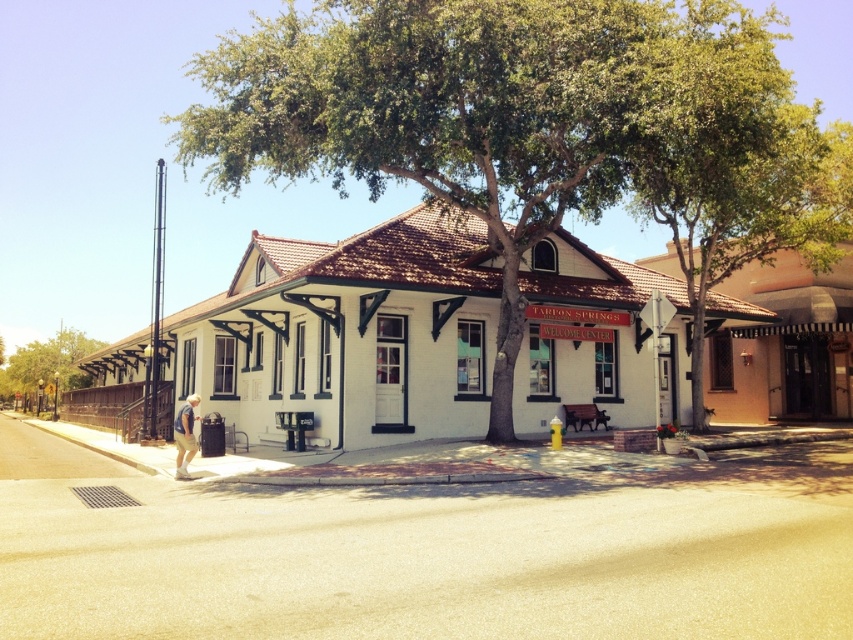
Question: Estimate the real-world distances between objects in this image. Which object is farther from the white cotton shirt at lower left?

Choices:
 (A) green leafy tree at center
 (B) white wood building at center

Answer: (A)

Question: Which point is farther from the camera taking this photo?

Choices:
 (A) pyautogui.click(x=228, y=112)
 (B) pyautogui.click(x=16, y=362)

Answer: (B)

Question: Can you confirm if white wood building at center is positioned below green leafy tree at lower left?

Choices:
 (A) no
 (B) yes

Answer: (A)

Question: Estimate the real-world distances between objects in this image. Which object is farther from the green leafy tree at center?

Choices:
 (A) green leafy tree at lower left
 (B) white cotton shirt at lower left

Answer: (A)

Question: Is white wood building at center wider than white cotton shirt at lower left?

Choices:
 (A) yes
 (B) no

Answer: (A)

Question: Does white wood building at center come in front of green leafy tree at lower left?

Choices:
 (A) yes
 (B) no

Answer: (A)